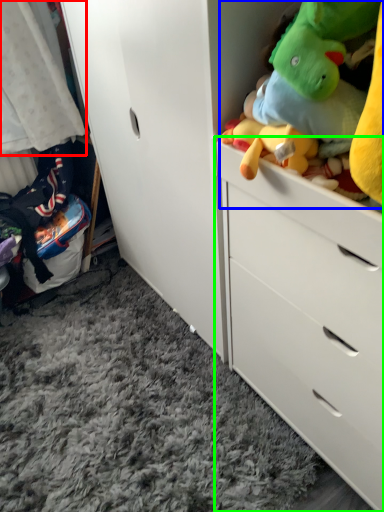
Question: Estimate the real-world distances between objects in this image. Which object is closer to baby clothe (highlighted by a red box), stuff (highlighted by a blue box) or chest of drawers (highlighted by a green box)?

Choices:
 (A) stuff
 (B) chest of drawers

Answer: (B)